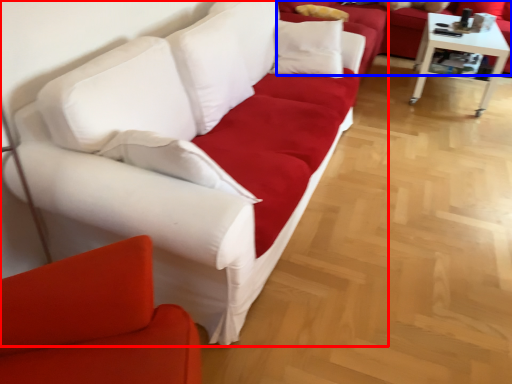
Question: Among these objects, which one is nearest to the camera, studio couch (highlighted by a red box) or studio couch (highlighted by a blue box)?

Choices:
 (A) studio couch
 (B) studio couch

Answer: (A)